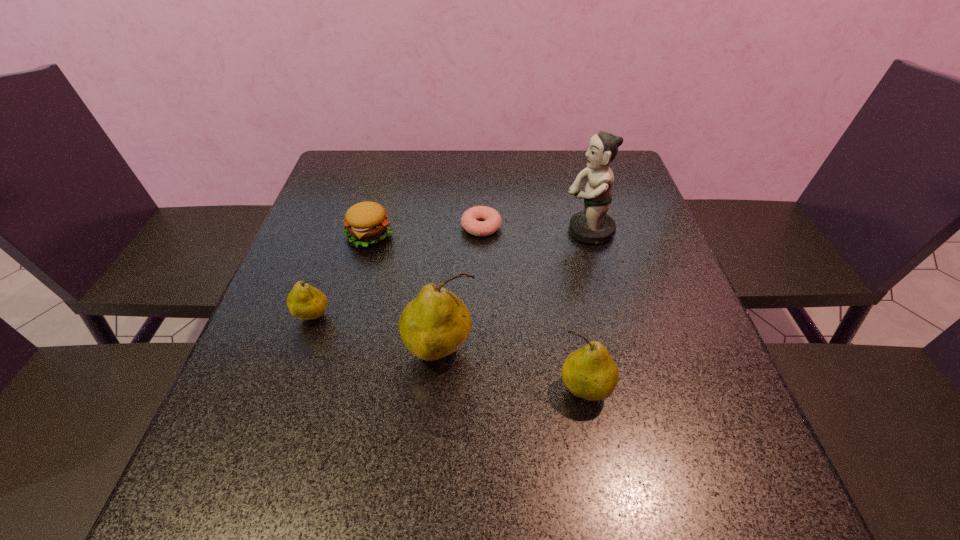
Locate an element on the screen. Image resolution: width=960 pixels, height=540 pixels. the leftmost pear is located at coordinates (304, 302).

Where is `the fourth tallest object`? the fourth tallest object is located at coordinates pos(304,302).

Locate an element on the screen. the second pear from right to left is located at coordinates (436, 323).

Identify the location of the fifth shortest object. Image resolution: width=960 pixels, height=540 pixels. (436, 323).

The width and height of the screenshot is (960, 540). What are the coordinates of `the rightmost pear` in the screenshot? It's located at coord(590,373).

Find the location of `the third tallest object`. the third tallest object is located at coordinates (590, 373).

This screenshot has width=960, height=540. Find the location of `figurine`. figurine is located at coordinates (593, 225).

Identify the location of the fifth tallest object. Image resolution: width=960 pixels, height=540 pixels. (366, 223).

Where is `the shortest object`? This screenshot has width=960, height=540. the shortest object is located at coordinates (470, 219).

Locate an element on the screen. The width and height of the screenshot is (960, 540). vacant space located 0.180m on the right of the shortest pear is located at coordinates (420, 317).